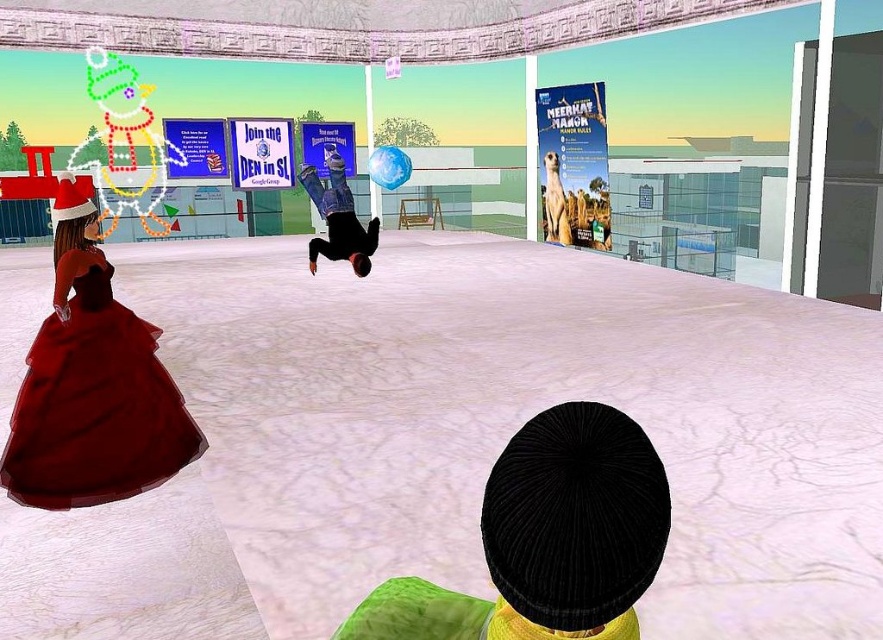
Question: Is black corduroy hat at center further to the viewer compared to velvet red dress at lower left?

Choices:
 (A) no
 (B) yes

Answer: (A)

Question: Is black corduroy hat at center smaller than black matte person at center?

Choices:
 (A) yes
 (B) no

Answer: (A)

Question: Can you confirm if velvet red dress at lower left is bigger than black matte person at center?

Choices:
 (A) yes
 (B) no

Answer: (B)

Question: Which point appears closest to the camera in this image?

Choices:
 (A) (122, 358)
 (B) (340, 163)
 (C) (391, 620)

Answer: (C)

Question: Which is nearer to the velvet red dress at lower left?

Choices:
 (A) black matte person at center
 (B) black corduroy hat at center

Answer: (B)

Question: Based on their relative distances, which object is farther from the velvet red dress at lower left?

Choices:
 (A) black matte person at center
 (B) black corduroy hat at center

Answer: (A)